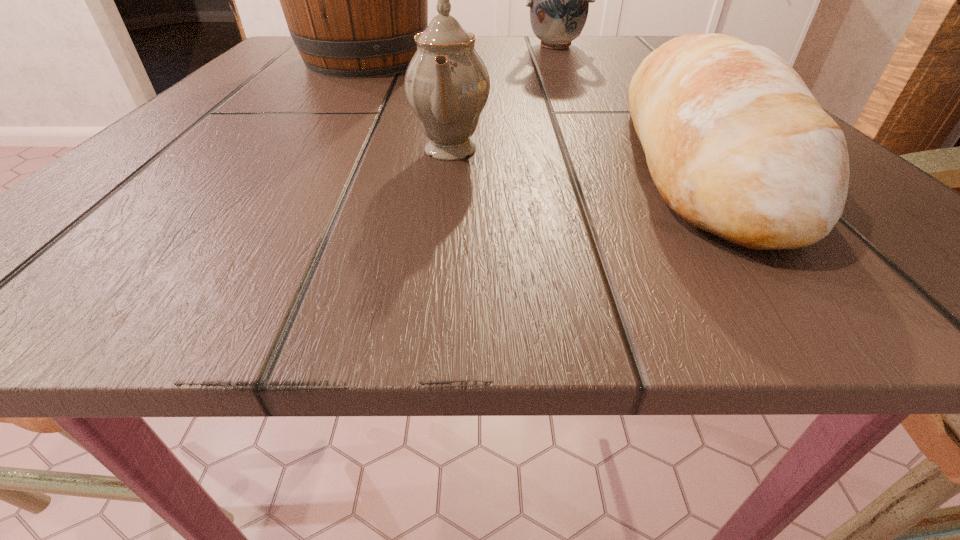
The width and height of the screenshot is (960, 540). Find the location of `vacant region at the far left corner`. vacant region at the far left corner is located at coordinates (288, 46).

This screenshot has height=540, width=960. Find the location of `vacant space at the near left corner of the desktop`. vacant space at the near left corner of the desktop is located at coordinates (49, 267).

Locate an element on the screen. free space between the cider and the second object from left to right is located at coordinates (408, 105).

This screenshot has height=540, width=960. What are the coordinates of `vacant space that's between the second tallest object and the shortest object` in the screenshot? It's located at (626, 102).

I want to click on free point between the bread and the pottery, so pos(626,102).

At what (x,y) coordinates should I click in order to perform the action: click on unoccupied position between the leftmost object and the chinaware. Please return your answer as a coordinate pair (x, y). Looking at the image, I should click on (408, 105).

Locate an element on the screen. The width and height of the screenshot is (960, 540). vacant area that lies between the second object from left to right and the tallest object is located at coordinates (408, 105).

In order to click on free space between the bread and the second shortest object in this screenshot , I will do `click(573, 154)`.

Find the location of `vacant point located between the chinaware and the pottery`. vacant point located between the chinaware and the pottery is located at coordinates (502, 98).

Find the location of a particular element. The width and height of the screenshot is (960, 540). vacant space that's between the pottery and the chinaware is located at coordinates (502, 98).